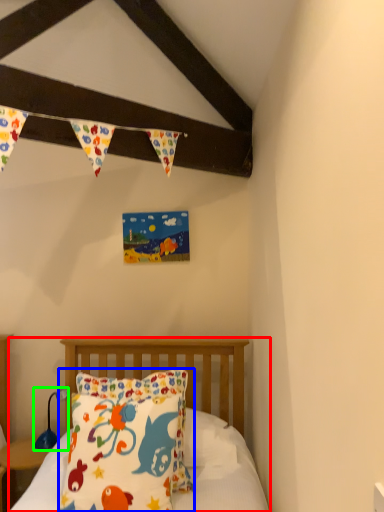
Question: Which is farther away from bed (highlighted by a red box)? pillow (highlighted by a blue box) or lamp (highlighted by a green box)?

Choices:
 (A) pillow
 (B) lamp

Answer: (A)